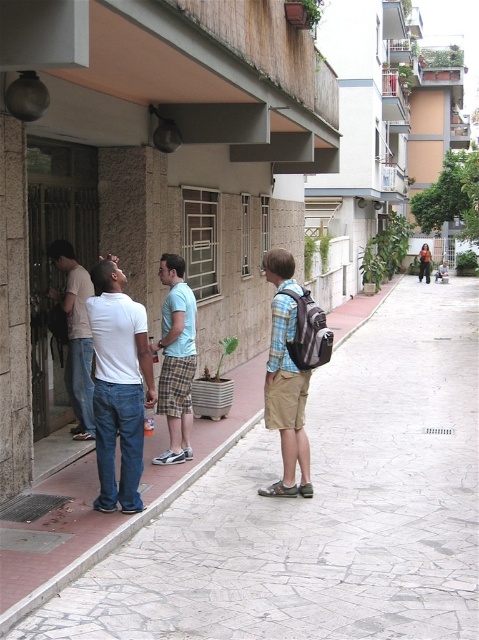
You are a photographer trying to capture a candid shot of the white matte shirt at center and the light blue plaid shorts at center. Since the shirt is positioned under the shorts, does this mean the shirt is lower on the body than the shorts?

Yes, the white matte shirt at center is positioned under light blue plaid shorts at center, so the shirt is lower on the body than the shorts.

You are a delivery person trying to reach the entrance of the building with the beige facade. You see a plaid shirt backpack at center and a matte white shirt at left on the sidewalk. Which object is closer to you as you approach the building?

The plaid shirt backpack at center is closer to the viewer than the matte white shirt at left, so the plaid shirt backpack at center is closer to you as you approach the building.